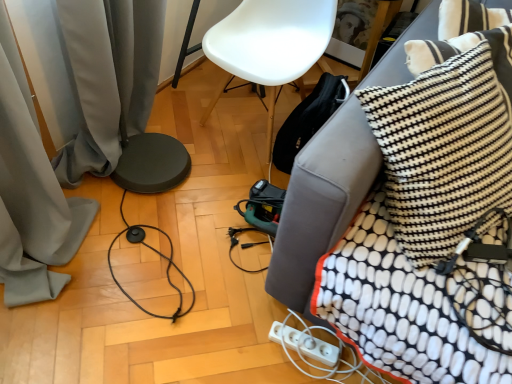
The height and width of the screenshot is (384, 512). Identify the location of free space underneath white plastic chair at center (from a real-world perspective). [x=247, y=125].